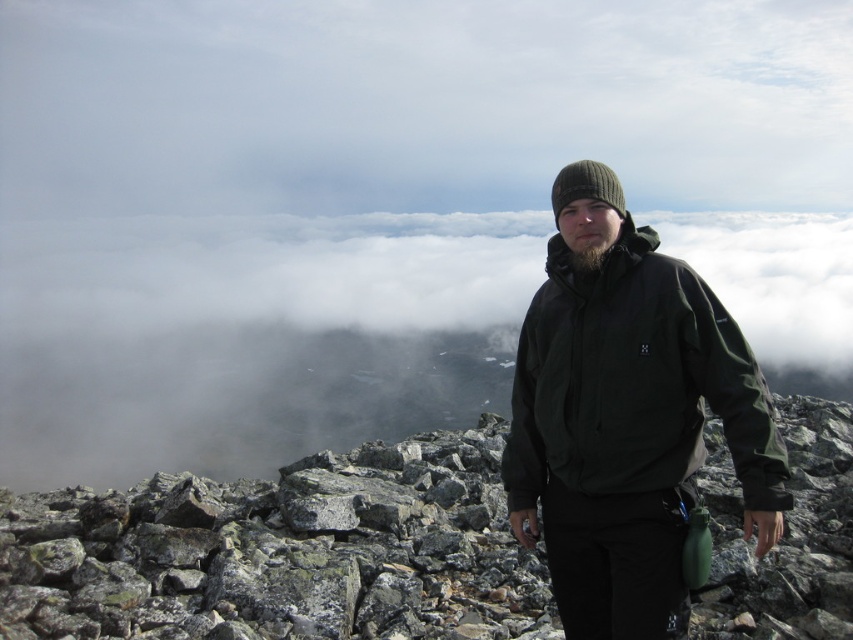
Who is more forward, (734, 508) or (611, 556)?

Point (611, 556)

Between gray rock pile at center and dark green softshell jacket at center, which one appears on the left side from the viewer's perspective?

Positioned to the left is dark green softshell jacket at center.

Is point (540, 588) more distant than point (524, 365)?

Yes, it is.

Where is `gray rock pile at center`? gray rock pile at center is located at coordinates (283, 552).